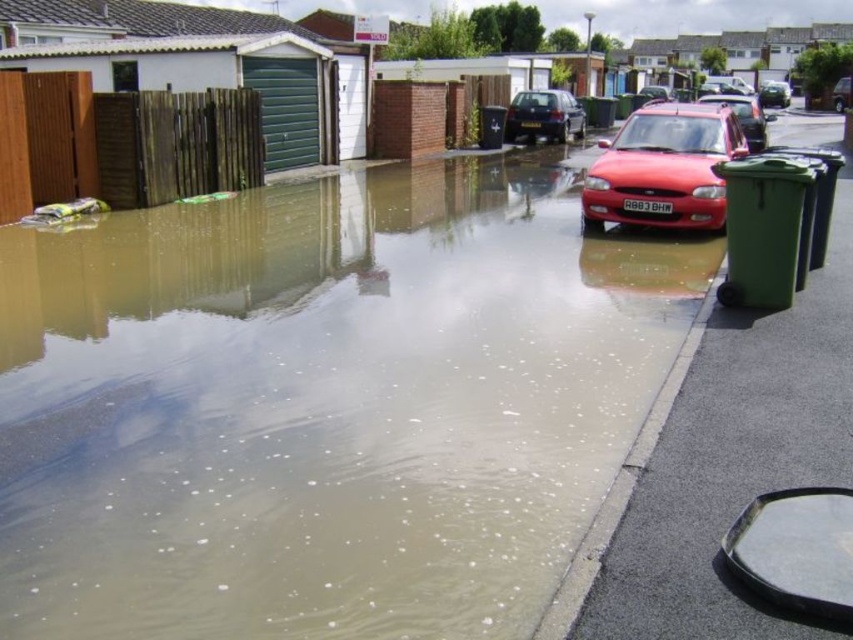
Between point (526, 122) and point (767, 116), which one is positioned in front?

Positioned in front is point (767, 116).

Between matte black car at center and metallic red car at center, which one has more height?

With more height is metallic red car at center.

Is point (535, 131) positioned behind point (764, 147)?

Yes, it is.

Identify the location of matte black car at center. (544, 116).

In the scene shown: Between brown/muddy water at lower left and metallic red car at center, which one appears on the left side from the viewer's perspective?

brown/muddy water at lower left

Find the location of a particular element. The image size is (853, 640). brown/muddy water at lower left is located at coordinates (323, 404).

Image resolution: width=853 pixels, height=640 pixels. Identify the location of brown/muddy water at lower left. (323, 404).

Is matte red car at center to the left of metallic silver car at upper right from the viewer's perspective?

Correct, you'll find matte red car at center to the left of metallic silver car at upper right.

Which is more to the left, matte red car at center or metallic silver car at upper right?

Positioned to the left is matte red car at center.

Which is in front, point (602, 170) or point (778, 106)?

Point (602, 170)

Where is `matte red car at center`? Image resolution: width=853 pixels, height=640 pixels. matte red car at center is located at coordinates (663, 168).